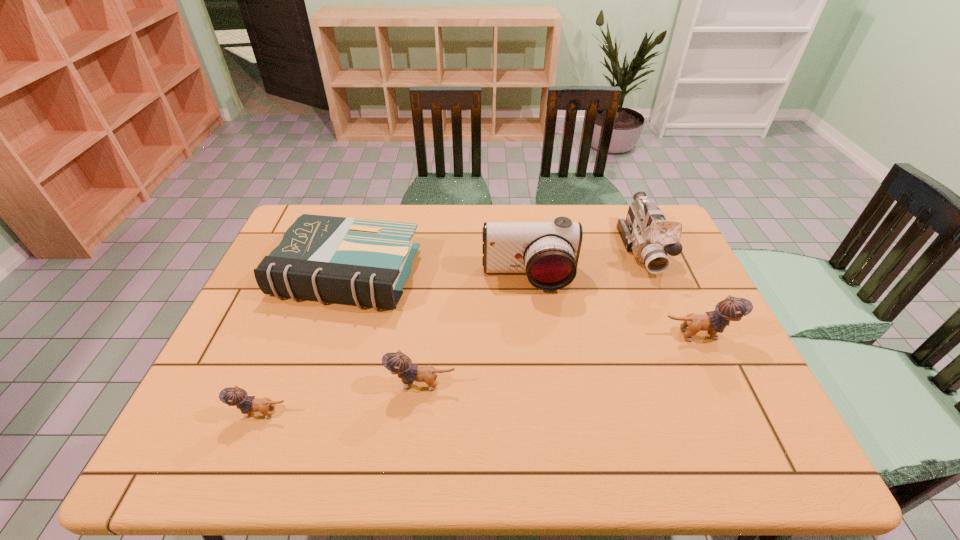
Locate an element on the screen. vacant space at the right edge of the desktop is located at coordinates (690, 353).

Find the location of `vacant region at the far right corner of the desktop`. vacant region at the far right corner of the desktop is located at coordinates (623, 210).

In the image, there is a desktop. In order to click on free region at the near right corner in this screenshot , I will do `click(757, 402)`.

Identify the location of vacant area that lies between the rightmost kitten and the paperback book. (522, 304).

Locate an element on the screen. Image resolution: width=960 pixels, height=540 pixels. unoccupied area between the second nearest kitten and the paperback book is located at coordinates (385, 329).

This screenshot has height=540, width=960. I want to click on unoccupied area between the second tallest kitten and the paperback book, so click(x=385, y=329).

Locate an element on the screen. This screenshot has width=960, height=540. empty space between the fourth object from left to right and the paperback book is located at coordinates (438, 276).

Locate an element on the screen. Image resolution: width=960 pixels, height=540 pixels. empty location between the nearest object and the right camcorder is located at coordinates (452, 331).

This screenshot has height=540, width=960. I want to click on free space that is in between the second tallest kitten and the paperback book, so click(385, 329).

Identify the location of free space between the second tallest kitten and the nearest kitten. The height and width of the screenshot is (540, 960). (342, 399).